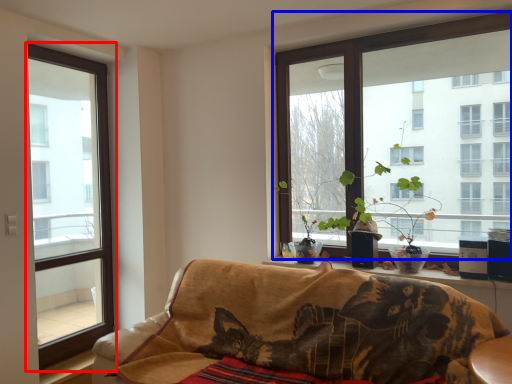
Question: Which object is further to the camera taking this photo, window (highlighted by a red box) or window (highlighted by a blue box)?

Choices:
 (A) window
 (B) window

Answer: (A)